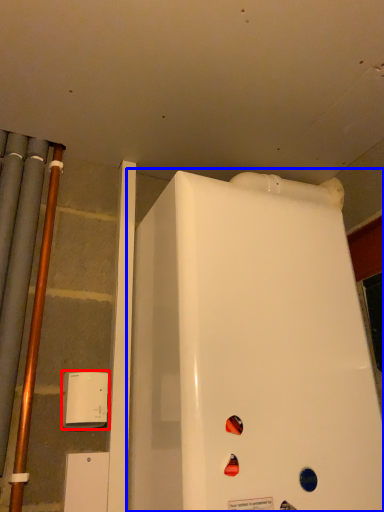
Question: Which point is further to the camera, appliance (highlighted by a red box) or refrigerator (highlighted by a blue box)?

Choices:
 (A) appliance
 (B) refrigerator

Answer: (A)